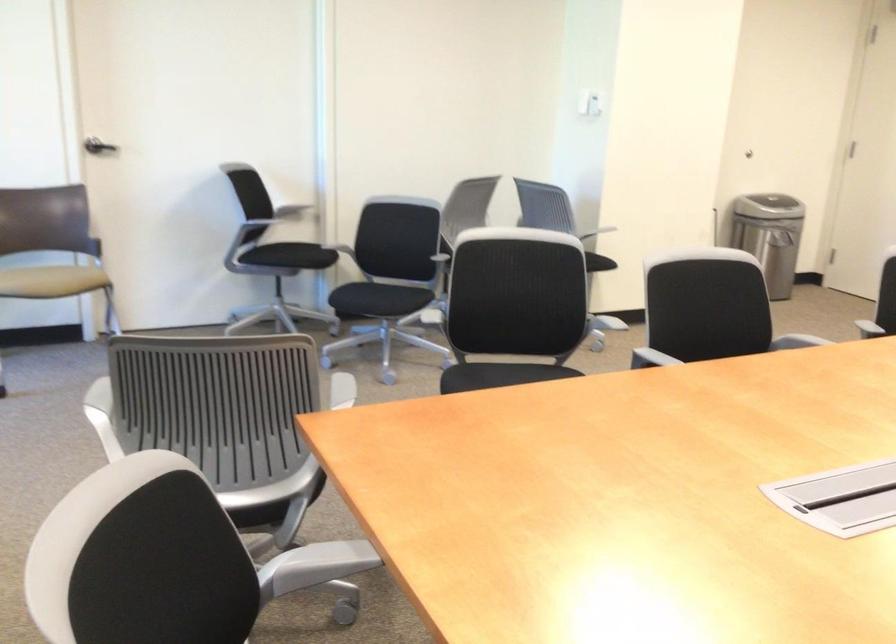
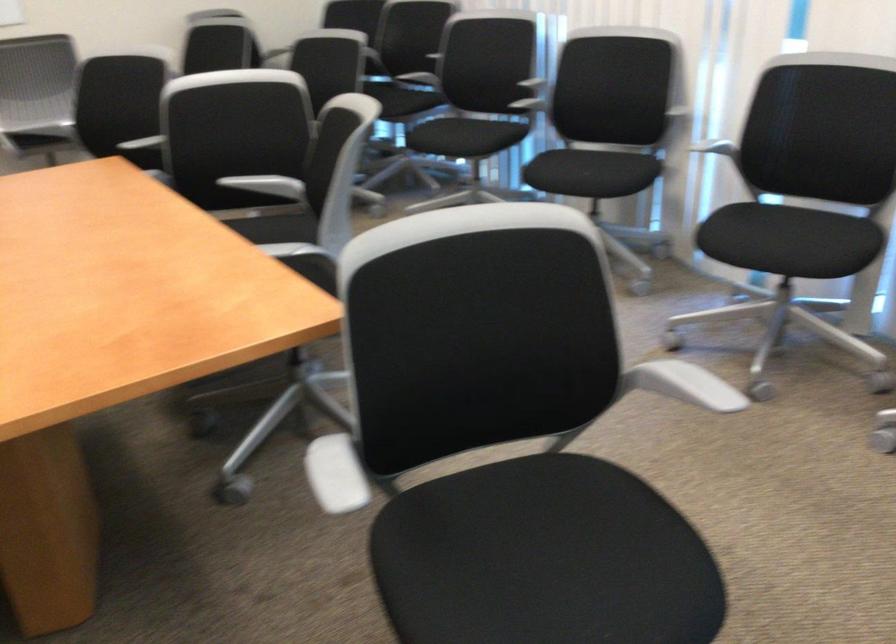
The point at (300,412) is marked in the first image. Where is the corresponding point in the second image?

(334, 474)